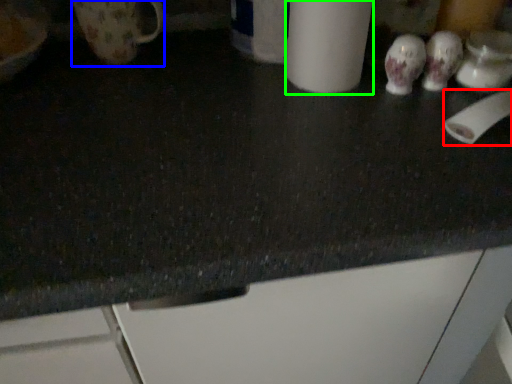
Question: Considering the real-world distances, which object is farthest from toilet paper (highlighted by a red box)? mug (highlighted by a blue box) or paper towel (highlighted by a green box)?

Choices:
 (A) mug
 (B) paper towel

Answer: (A)